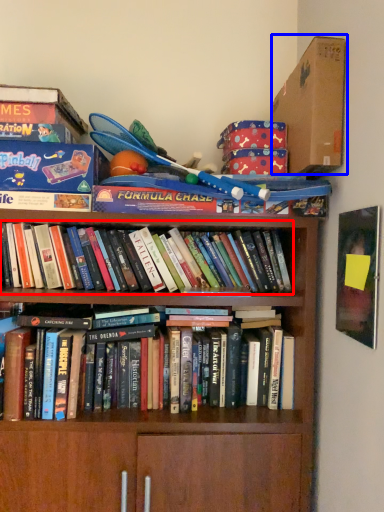
Question: Which point is closer to the camera, book (highlighted by a red box) or cardboard box (highlighted by a blue box)?

Choices:
 (A) book
 (B) cardboard box

Answer: (B)